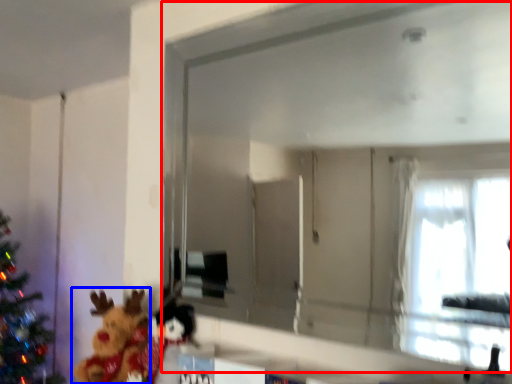
Question: Which point is further to the camera, mirror (highlighted by a red box) or toy (highlighted by a blue box)?

Choices:
 (A) mirror
 (B) toy

Answer: (B)